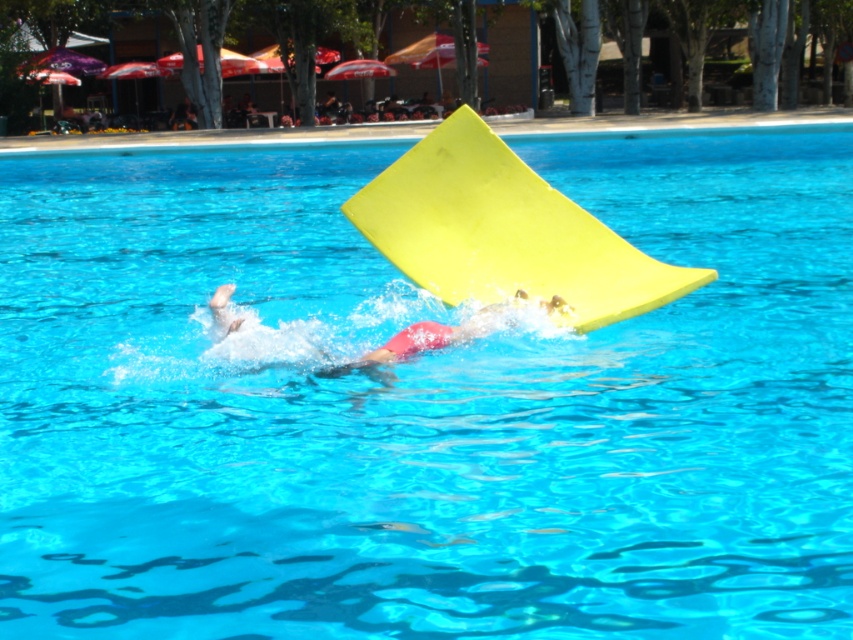
You are standing at the edge of the pool and want to throw a ball to hit both the point at coordinates point (531,262) and point (213,314). Which point should you aim for first if you want to hit them in order from closest to farthest from you?

You should aim for point (213,314) first because it is closer to you than point (531,262), which is further away.